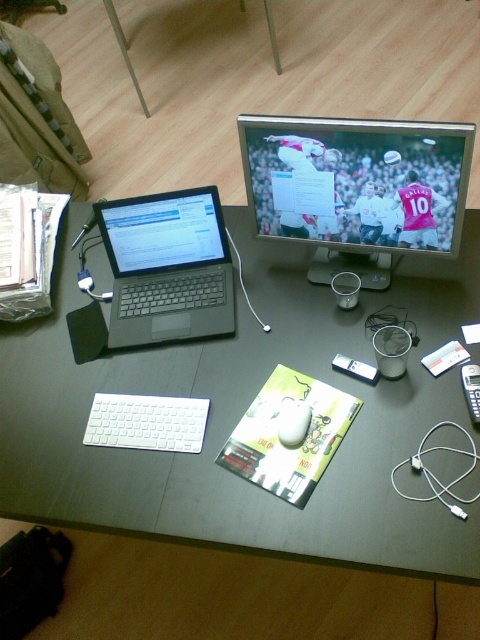
You are a remote worker who needs to reach your keyboard while sitting at the desk shown. Based on the image, where is the white matte keyboard at center located?

The white matte keyboard at center is located at the point [146,422] on the desk.

You are setting up a new keyboard and monitor on your desk. You want the keyboard to be on the left side of the monitor. Based on the current setup shown in the image, is the white matte keyboard at center positioned correctly relative to the matte black monitor at center?

The matte black monitor at center is to the right of the white matte keyboard at center, so the keyboard is already positioned correctly to the left of the monitor.